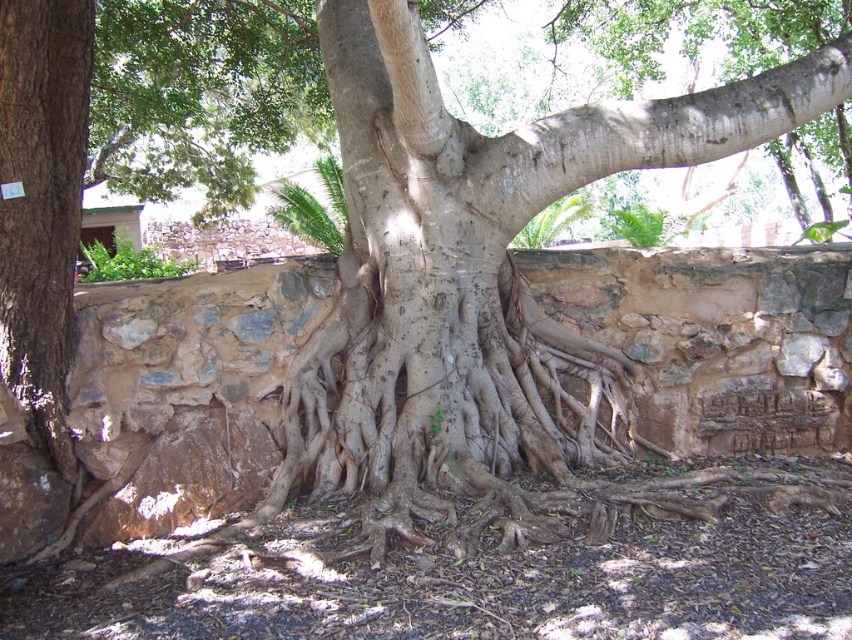
You are a botanist examining the tree. You notice two areas of the tree trunk. One has smooth gray bark at center and the other has brown rough bark at left. Which area is positioned to the right of the other?

The smooth gray bark at center is to the right of brown rough bark at left.

You are a botanist examining the tree. You notice the smooth gray bark at center and the brown rough bark at left. Which part of the tree is higher up?

The smooth gray bark at center is higher up than the brown rough bark at left.